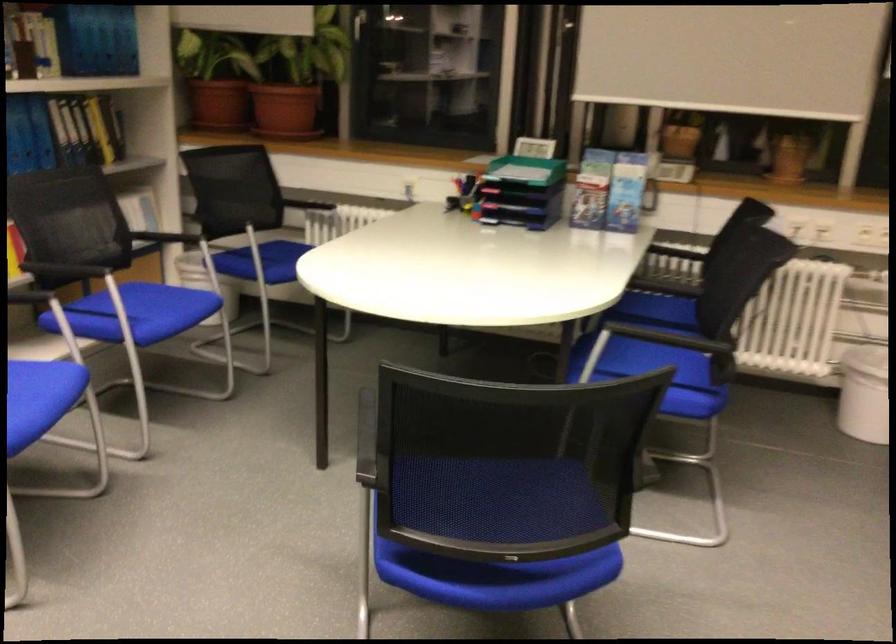
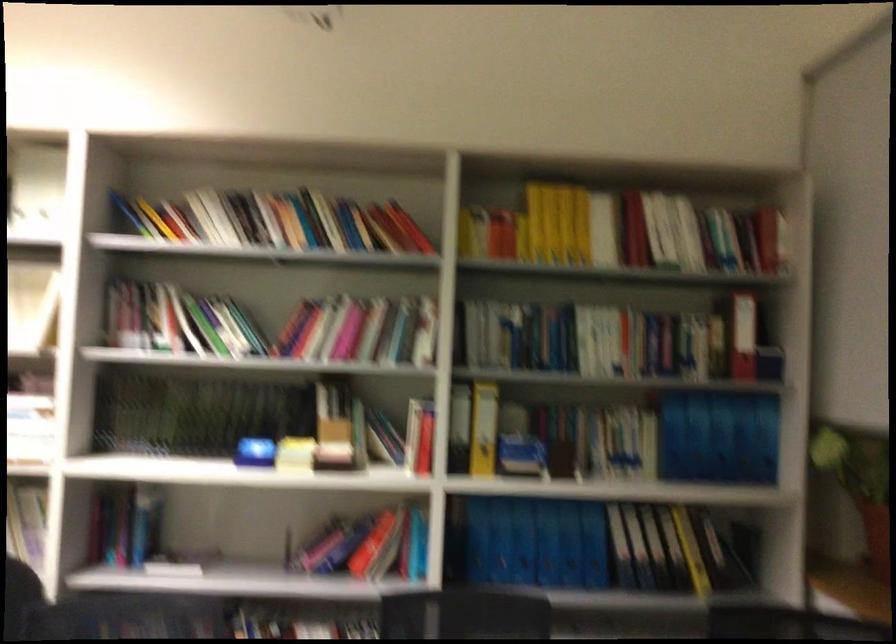
Locate, in the second image, the point that corresponds to point 113,134 in the first image.

(716, 554)